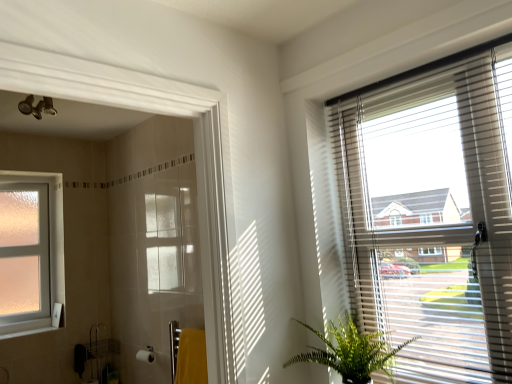
Question: Considering the relative sizes of frosted glass window at left and matte gray blinds at upper right in the image provided, is frosted glass window at left smaller than matte gray blinds at upper right?

Choices:
 (A) yes
 (B) no

Answer: (A)

Question: Does frosted glass window at left appear on the left side of matte gray blinds at upper right?

Choices:
 (A) no
 (B) yes

Answer: (B)

Question: From a real-world perspective, is frosted glass window at left under matte gray blinds at upper right?

Choices:
 (A) no
 (B) yes

Answer: (A)

Question: Is frosted glass window at left oriented towards matte gray blinds at upper right?

Choices:
 (A) no
 (B) yes

Answer: (B)

Question: Is frosted glass window at left far away from matte gray blinds at upper right?

Choices:
 (A) yes
 (B) no

Answer: (A)

Question: Does frosted glass window at left lie behind matte gray blinds at upper right?

Choices:
 (A) yes
 (B) no

Answer: (A)

Question: From a real-world perspective, is white glossy shower door at left located higher than green leafy plant at lower right?

Choices:
 (A) yes
 (B) no

Answer: (A)

Question: Is white glossy shower door at left smaller than green leafy plant at lower right?

Choices:
 (A) no
 (B) yes

Answer: (A)

Question: From a real-world perspective, is white glossy shower door at left beneath green leafy plant at lower right?

Choices:
 (A) yes
 (B) no

Answer: (B)

Question: Considering the relative sizes of white glossy shower door at left and green leafy plant at lower right in the image provided, is white glossy shower door at left taller than green leafy plant at lower right?

Choices:
 (A) no
 (B) yes

Answer: (B)

Question: Does white glossy shower door at left have a larger size compared to green leafy plant at lower right?

Choices:
 (A) no
 (B) yes

Answer: (B)

Question: Can you confirm if white glossy shower door at left is wider than green leafy plant at lower right?

Choices:
 (A) no
 (B) yes

Answer: (A)

Question: Considering the relative sizes of white glossy shower door at left and white plastic window sill at lower left in the image provided, is white glossy shower door at left smaller than white plastic window sill at lower left?

Choices:
 (A) yes
 (B) no

Answer: (B)